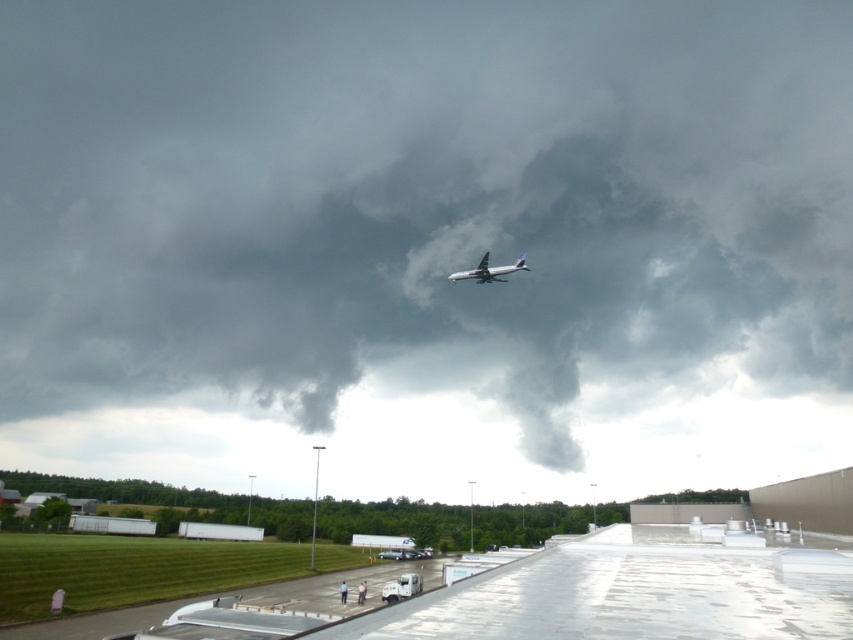
Question: Does dark gray cloud at upper center appear over white glossy airplane at upper center?

Choices:
 (A) yes
 (B) no

Answer: (A)

Question: Does dark gray cloud at upper center appear under white glossy airplane at upper center?

Choices:
 (A) yes
 (B) no

Answer: (B)

Question: Can you confirm if dark gray cloud at upper center is positioned to the left of white glossy airplane at upper center?

Choices:
 (A) no
 (B) yes

Answer: (B)

Question: Which point appears farthest from the camera in this image?

Choices:
 (A) (357, 154)
 (B) (486, 262)

Answer: (A)

Question: Which point is closer to the camera?

Choices:
 (A) dark gray cloud at upper center
 (B) white glossy airplane at upper center

Answer: (B)